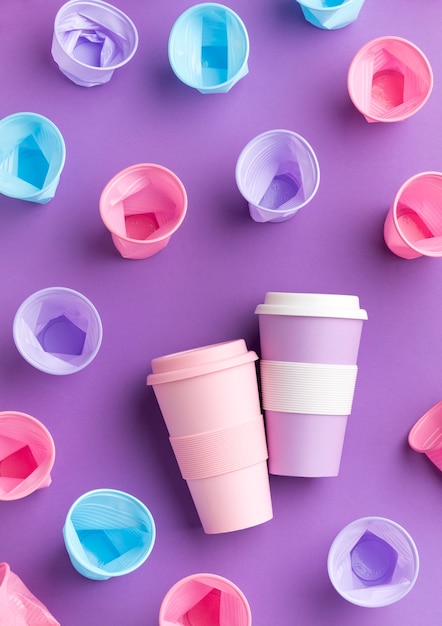
You are a GUI agent. You are given a task and a screenshot of the screen. Output one action in this format:
    pyautogui.click(x=<x>, y=<y>)
    Task: Click on the purple cups
    The image size is (442, 626).
    Given the screenshot: What is the action you would take?
    pyautogui.click(x=308, y=459), pyautogui.click(x=343, y=552), pyautogui.click(x=21, y=340), pyautogui.click(x=298, y=172), pyautogui.click(x=98, y=43)